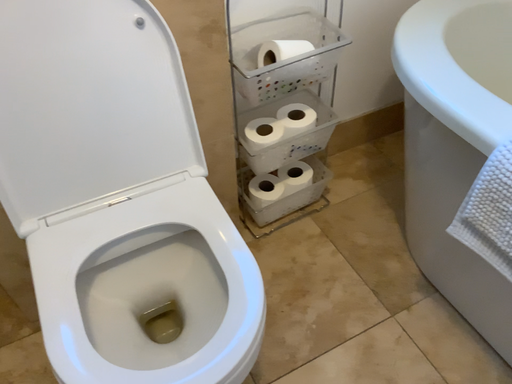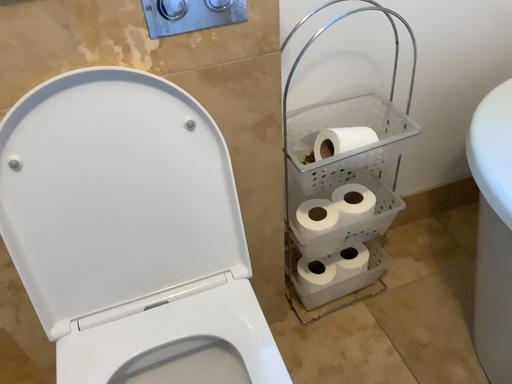
Question: How did the camera likely rotate when shooting the video?

Choices:
 (A) rotated left
 (B) rotated right

Answer: (A)